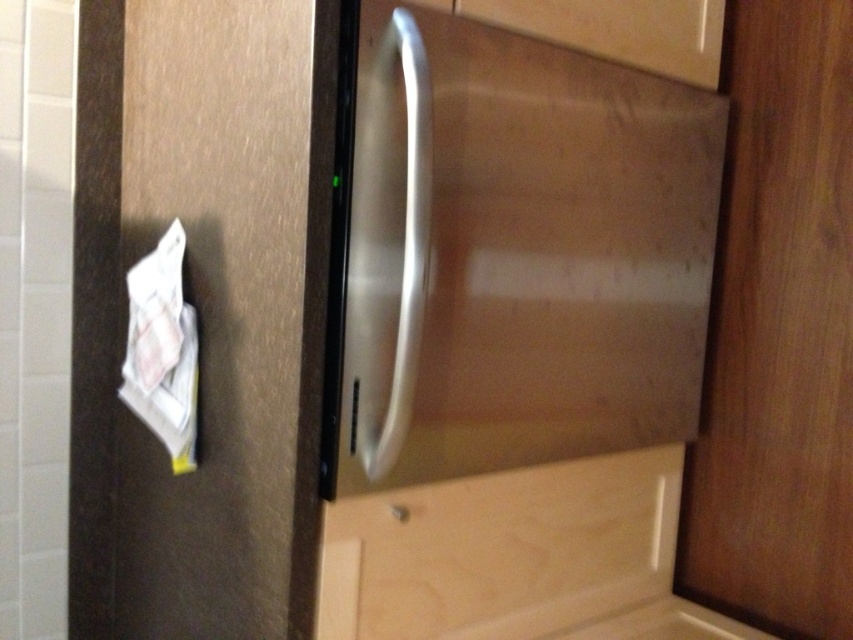
Question: Which point is farther to the camera?

Choices:
 (A) light wood drawer at lower center
 (B) wooden door at right

Answer: (B)

Question: Which of the following is the closest to the observer?

Choices:
 (A) satin silver handle at center
 (B) light wood drawer at lower center
 (C) wooden door at right
 (D) matte wood drawer at upper center

Answer: (A)

Question: Among these points, which one is nearest to the camera?

Choices:
 (A) (392, 272)
 (B) (840, 376)

Answer: (A)

Question: Does light wood drawer at lower center come behind matte wood drawer at upper center?

Choices:
 (A) no
 (B) yes

Answer: (A)

Question: Can you confirm if brown matte door at left is positioned below light wood drawer at lower center?

Choices:
 (A) no
 (B) yes

Answer: (A)

Question: Is wooden door at right thinner than matte wood drawer at upper center?

Choices:
 (A) no
 (B) yes

Answer: (B)